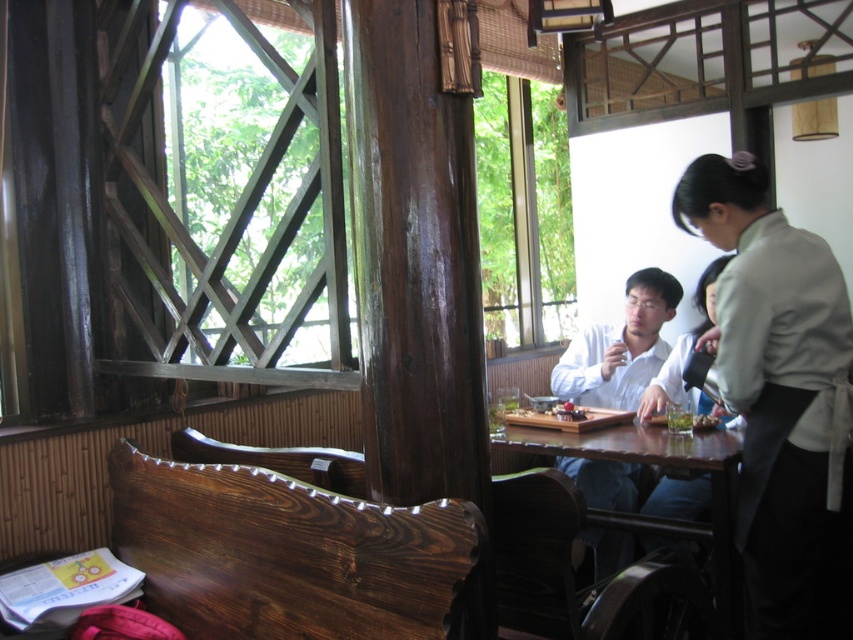
You are a customer sitting at the wooden bench with a dark finish in the foreground of the image. You want to reach the light beige fabric apron at right located at point (780, 397). Is the apron within your immediate reach from your current position?

The light beige fabric apron at right is located at point (780, 397). Since you are sitting at the wooden bench with a dark finish in the foreground, the apron is positioned to your right and slightly ahead, so it should be within your immediate reach.

You are a customer sitting at the wooden bench with a dark finish. You want to reach the light beige fabric apron at right. Is it within your immediate reach?

The light beige fabric apron at right is located at point (780, 397), which is to the right side of the frame. Since you are sitting on the wooden bench with a dark finish, which is in the foreground, the apron may not be within immediate reach unless you move closer. Consider checking the distance between your current position and the apron.

You are a customer at the restaurant and want to place a large plate on the brown wooden table at center. The plate is as wide as the green leafy vegetables at table. Will the plate fit on the table?

The brown wooden table at center is wider than the green leafy vegetables at table, so the plate, which is as wide as the vegetables, will fit on the table.